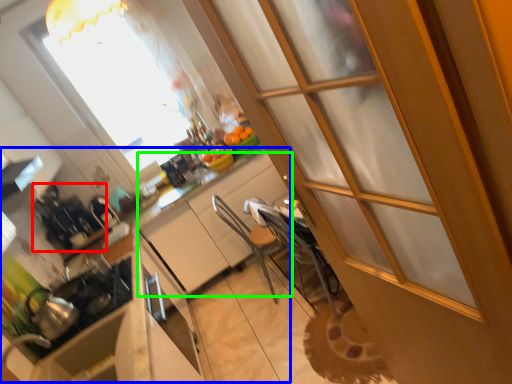
Question: Which object is positioned closest to appliance (highlighted by a red box)? Select from counter (highlighted by a blue box) and cabinetry (highlighted by a green box).

Choices:
 (A) counter
 (B) cabinetry

Answer: (A)